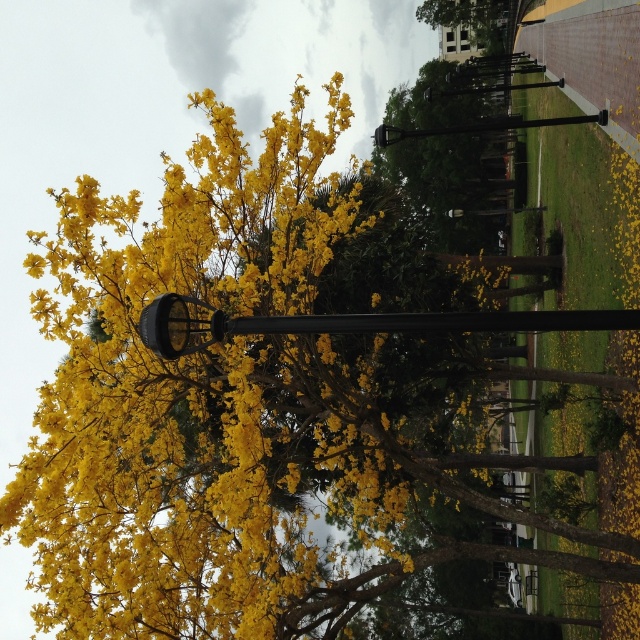
Question: Can you confirm if black metal lamp post at center is bigger than black metal pole at center?

Choices:
 (A) yes
 (B) no

Answer: (B)

Question: Which of the following is the farthest from the observer?

Choices:
 (A) (461, 129)
 (B) (164, 304)

Answer: (A)

Question: Does black metal lamp post at center appear on the right side of black metal pole at center?

Choices:
 (A) no
 (B) yes

Answer: (A)

Question: Is black metal lamp post at center smaller than black metal pole at center?

Choices:
 (A) yes
 (B) no

Answer: (A)

Question: Which point is farther to the camera?

Choices:
 (A) black metal pole at center
 (B) black metal lamp post at center

Answer: (A)